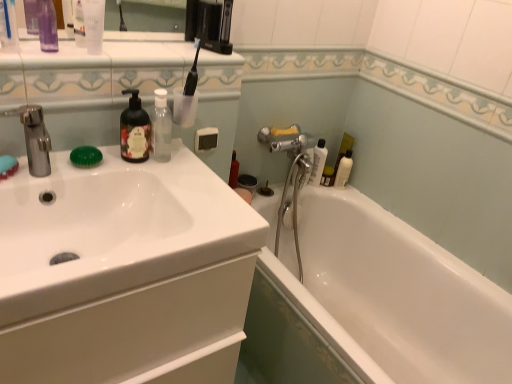
The image size is (512, 384). I want to click on free point in front of matte black soap dispenser at upper left, so click(119, 172).